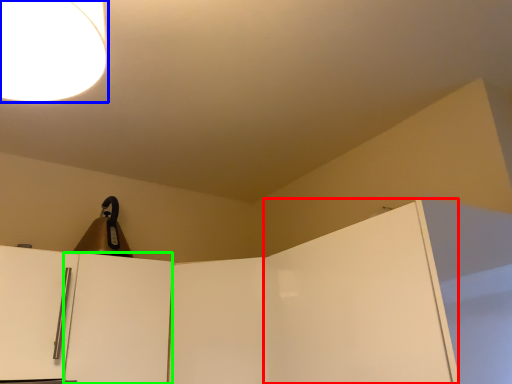
Question: Which is nearer to the door (highlighted by a red box)? lamp (highlighted by a blue box) or door (highlighted by a green box).

Choices:
 (A) lamp
 (B) door

Answer: (B)